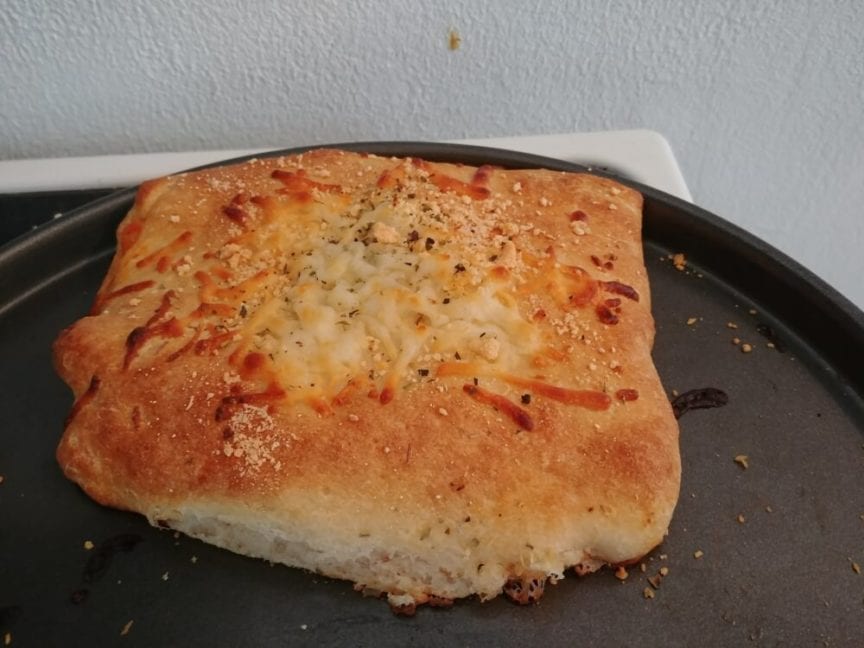
This screenshot has width=864, height=648. In order to click on white wall in this screenshot , I will do `click(297, 84)`.